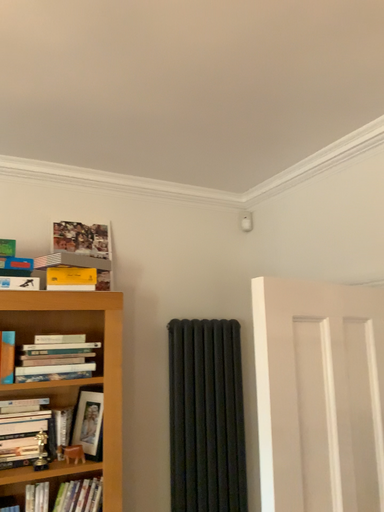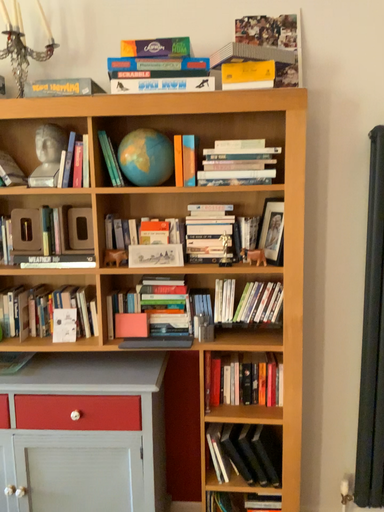
Question: Which way did the camera rotate in the video?

Choices:
 (A) rotated upward
 (B) rotated downward

Answer: (B)